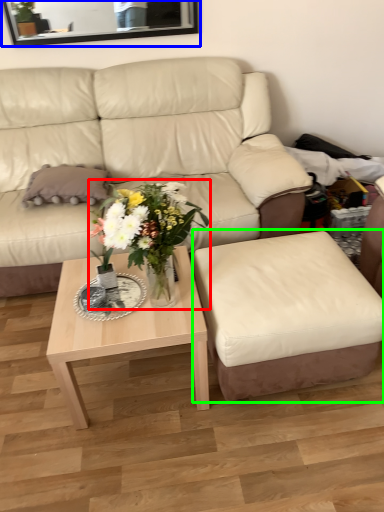
Question: Which object is the closest to the houseplant (highlighted by a red box)? Choose among these: mirror (highlighted by a blue box) or swivel chair (highlighted by a green box).

Choices:
 (A) mirror
 (B) swivel chair

Answer: (B)